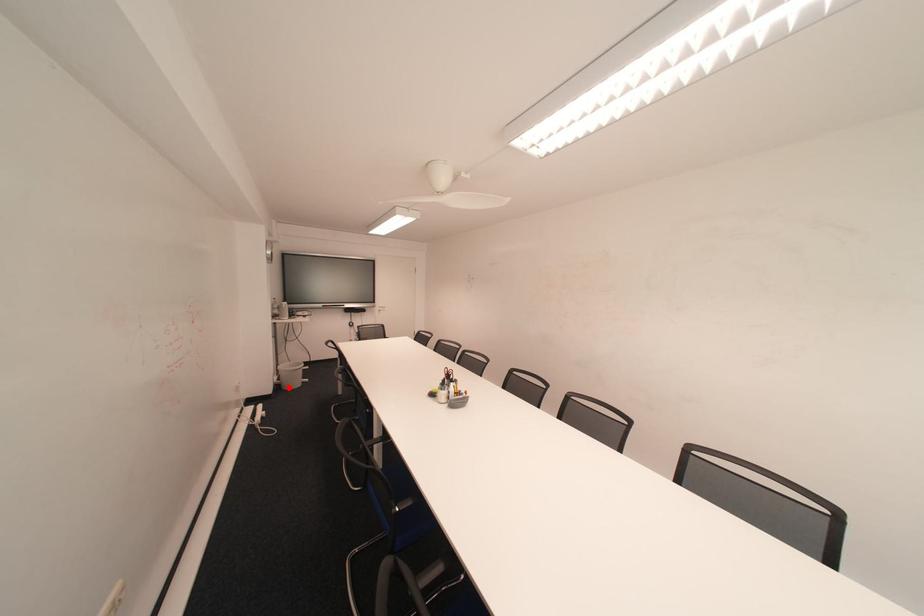
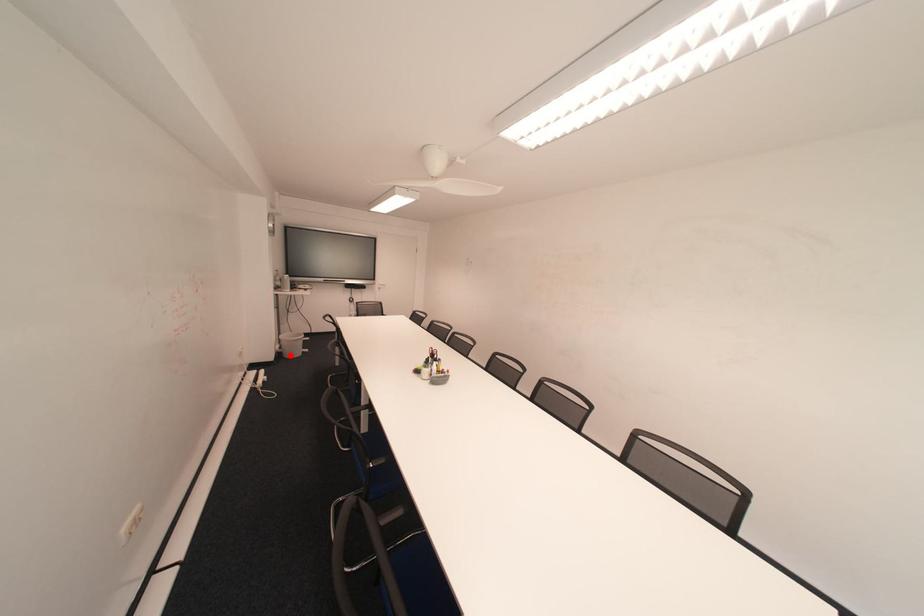
I am providing you with two images of the same scene from different viewpoints. A red point is marked on the first image and another point is marked on the second image. Are the points marked in image1 and image2 representing the same 3D position?

Yes